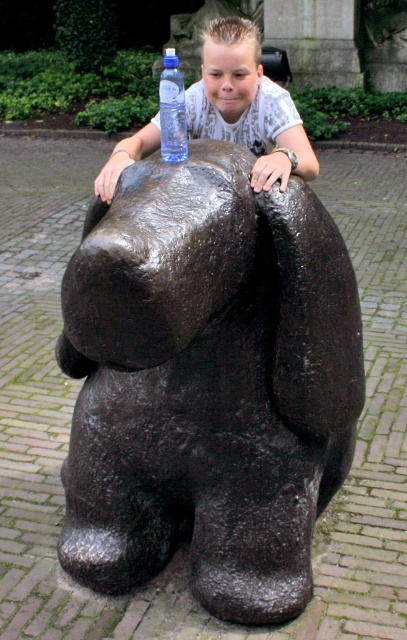
You are a photographer trying to capture both the black polished stone bear at center and the transparent plastic bottle at upper center in a single shot. Given their size difference, which object should you focus on first to ensure both are in frame?

Since the black polished stone bear at center is larger than the transparent plastic bottle at upper center, you should focus on the black polished stone bear at center first to ensure it fits within the frame before adjusting for the smaller bottle.

You are a photographer trying to capture the black polished stone bear at center and the smooth blue water bottle at upper center in a single shot. Which object will appear smaller in your photo?

The smooth blue water bottle at upper center will appear smaller because it is farther from the viewer compared to the black polished stone bear at center.

You are standing at the origin point in the image. There are two points marked in the scene. The first point is at coordinate point(284, 512) and the second is at point(177, 115). Which of these points is located further away from your current position?

Point(284, 512) is behind point(177, 115), so it is further away from your current position at the origin.